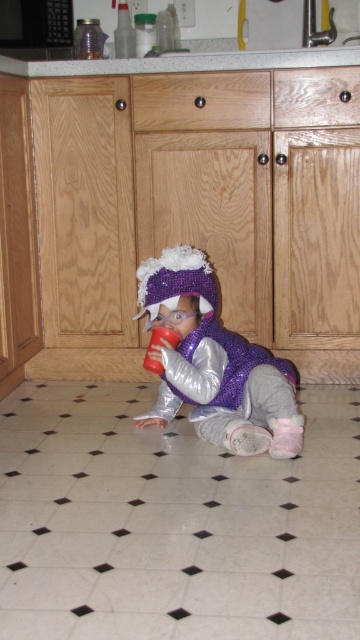
Question: Is sparkly purple vest at center closer to the viewer compared to granite countertop at upper center?

Choices:
 (A) no
 (B) yes

Answer: (B)

Question: Does sparkly purple vest at center have a smaller size compared to granite countertop at upper center?

Choices:
 (A) yes
 (B) no

Answer: (A)

Question: Which point is closer to the camera?

Choices:
 (A) (83, 74)
 (B) (254, 445)

Answer: (B)

Question: Among these points, which one is nearest to the camera?

Choices:
 (A) (241, 400)
 (B) (298, 49)

Answer: (A)

Question: Is sparkly purple vest at center bigger than granite countertop at upper center?

Choices:
 (A) no
 (B) yes

Answer: (A)